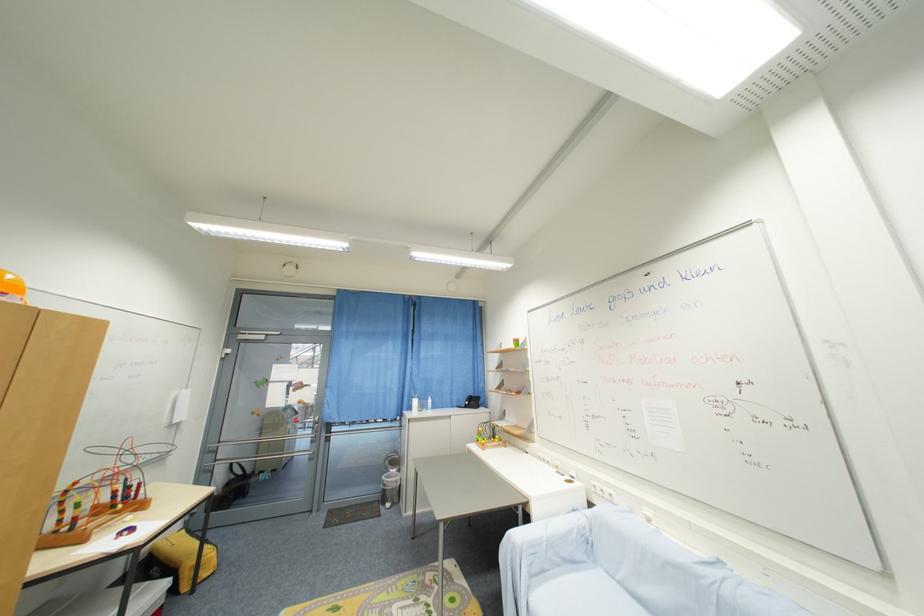
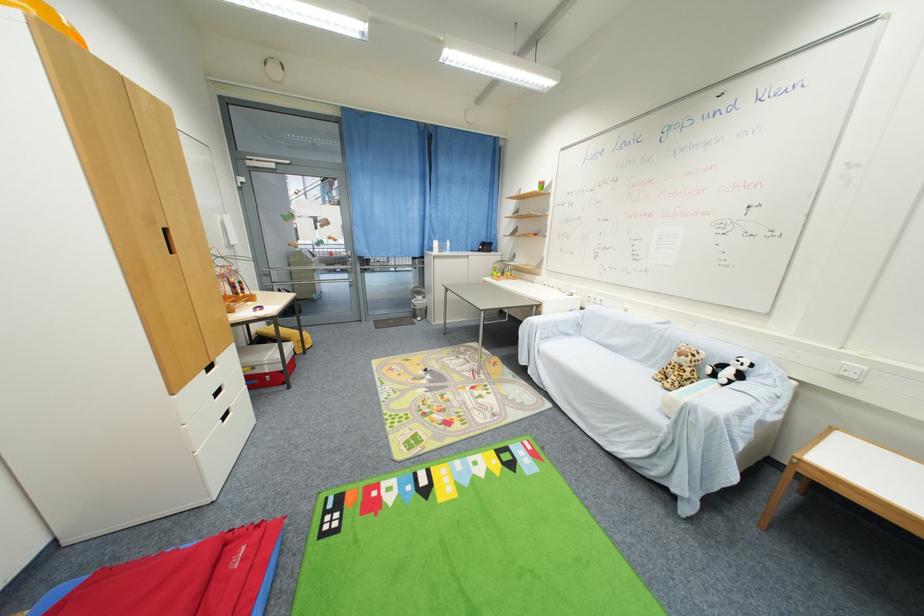
Locate, in the second image, the point that corresponds to point 388,479 in the first image.

(418, 302)